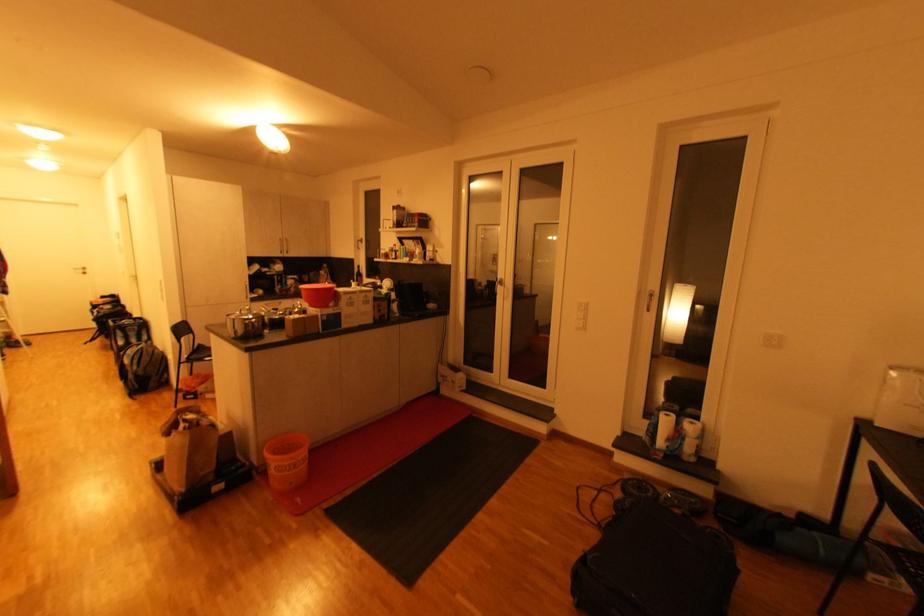
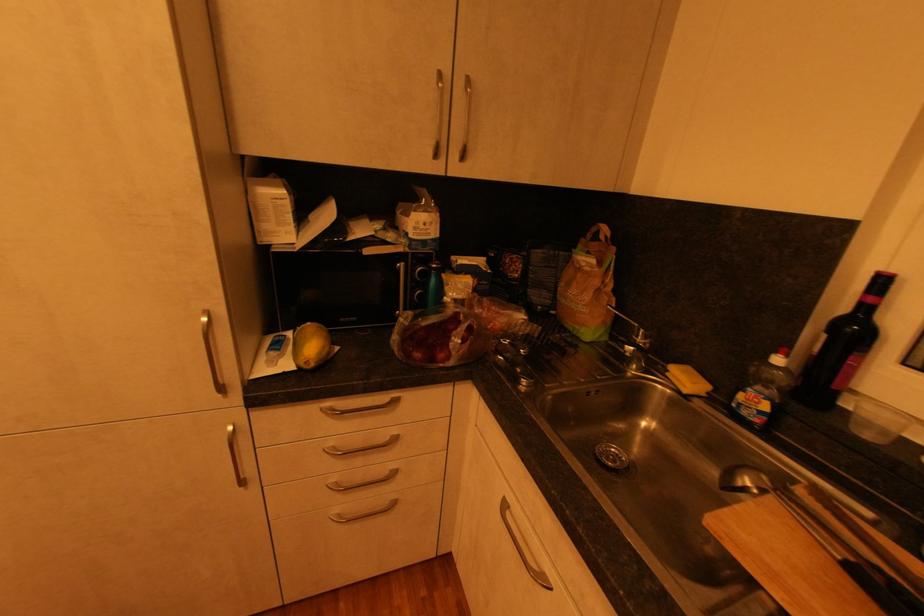
In the second image, find the point that corresponds to the point at 330,273 in the first image.

(604, 264)